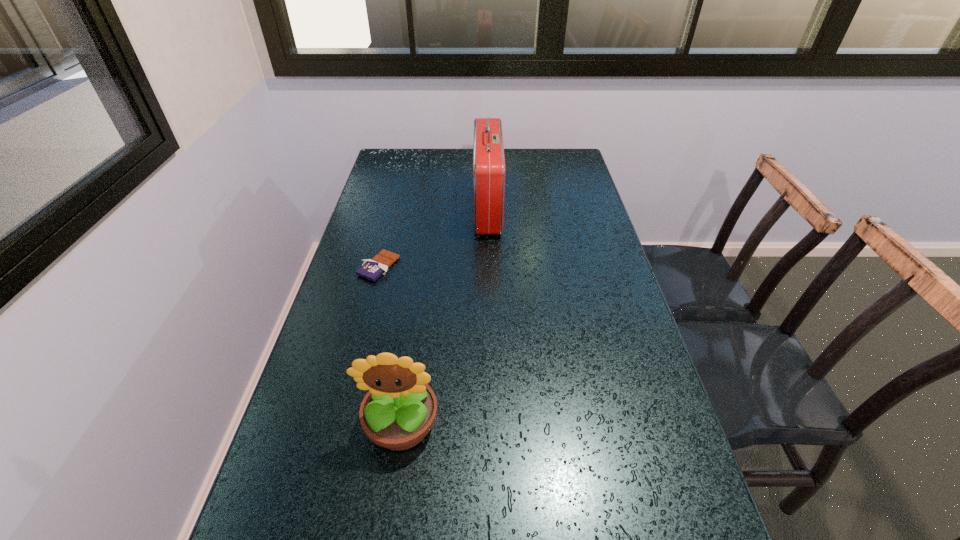
In order to click on the first-aid kit in this screenshot , I will do `click(488, 151)`.

Locate an element on the screen. the tallest object is located at coordinates (488, 151).

Where is `the second shortest object`? the second shortest object is located at coordinates (400, 409).

This screenshot has width=960, height=540. Identify the location of sunflower. (400, 409).

Identify the location of chocolate bar. The image size is (960, 540). (372, 269).

Where is `the second nearest object`? Image resolution: width=960 pixels, height=540 pixels. the second nearest object is located at coordinates (372, 269).

Image resolution: width=960 pixels, height=540 pixels. Find the location of `vacant area situated 0.140m on the side of the rightmost object with the first aid cross symbol`. vacant area situated 0.140m on the side of the rightmost object with the first aid cross symbol is located at coordinates (433, 208).

Locate an element on the screen. free space located on the side of the rightmost object with the first aid cross symbol is located at coordinates (447, 208).

The height and width of the screenshot is (540, 960). I want to click on vacant point located on the side of the rightmost object with the first aid cross symbol, so click(x=418, y=208).

Locate an element on the screen. vacant position located 0.330m on the right of the shortest object is located at coordinates (514, 267).